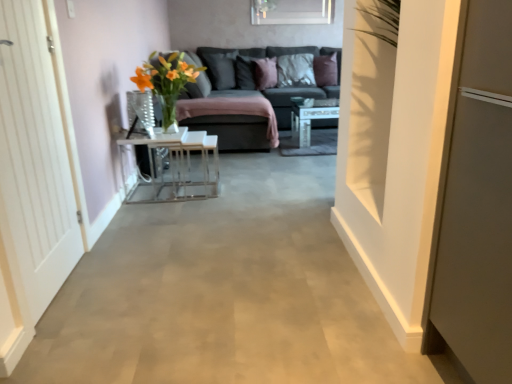
Locate an element on the screen. This screenshot has width=512, height=384. vacant area located to the right-hand side of clear glass vase at center is located at coordinates (164, 134).